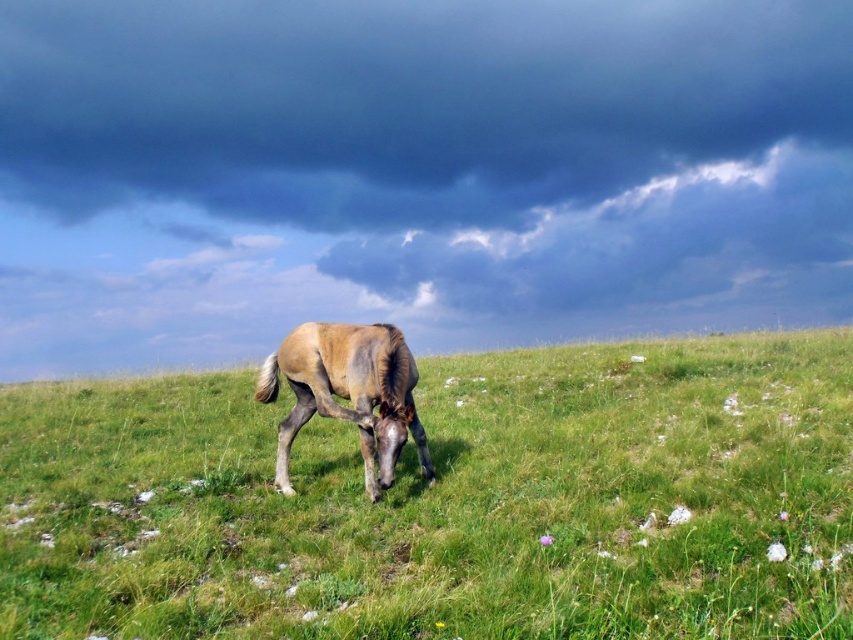
Where is `green grassy at center`? green grassy at center is located at coordinates (445, 500).

Looking at this image, is green grassy at center positioned behind brown textured horse at center?

No, green grassy at center is closer to the viewer.

I want to click on green grassy at center, so click(x=445, y=500).